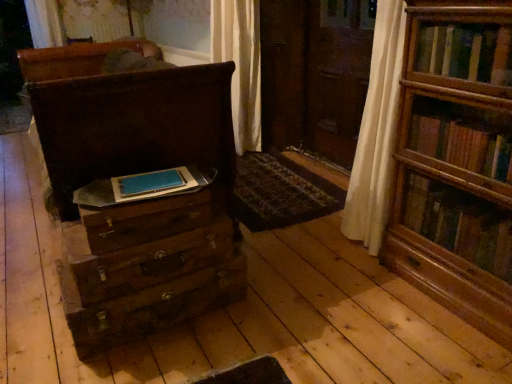
Identify the location of free region under blue matte paper at center (from a real-world perspective). (162, 182).